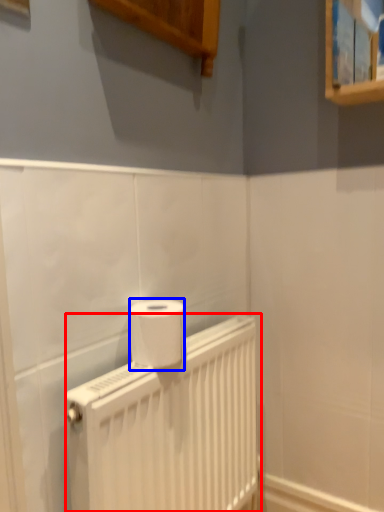
Question: Which of the following is the farthest to the observer, radiator (highlighted by a red box) or toilet paper (highlighted by a blue box)?

Choices:
 (A) radiator
 (B) toilet paper

Answer: (B)